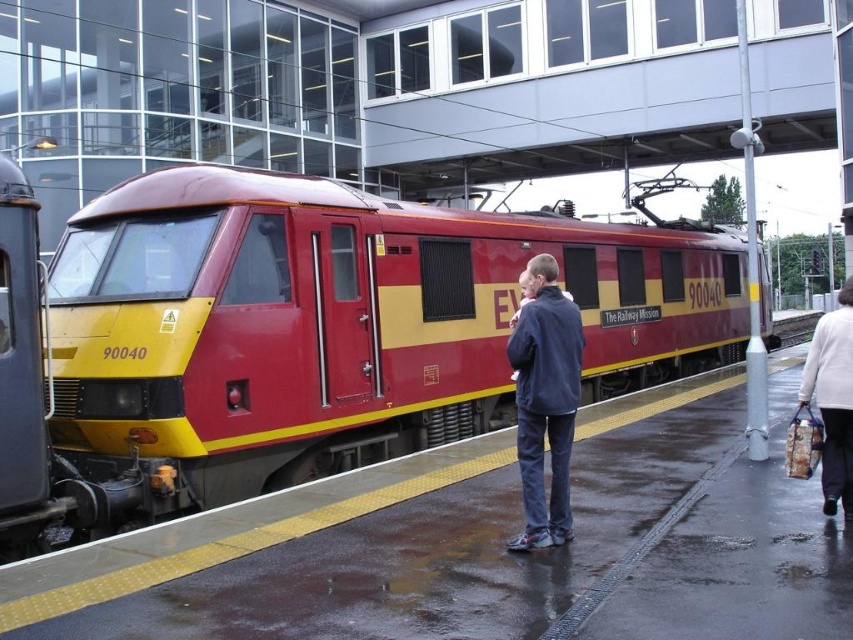
Which is more to the left, yellow rubber platform at center or white sweater at lower right?

yellow rubber platform at center is more to the left.

Is yellow rubber platform at center above white sweater at lower right?

No, yellow rubber platform at center is not above white sweater at lower right.

Which is behind, point (767, 632) or point (828, 394)?

Point (828, 394)

Where is `yellow rubber platform at center`? The image size is (853, 640). yellow rubber platform at center is located at coordinates click(485, 545).

Can you confirm if matte red/yellow train at center is shorter than yellow rubber platform at center?

No, matte red/yellow train at center is not shorter than yellow rubber platform at center.

Can you confirm if matte red/yellow train at center is thinner than yellow rubber platform at center?

In fact, matte red/yellow train at center might be wider than yellow rubber platform at center.

Is point (398, 451) more distant than point (746, 504)?

Yes, point (398, 451) is farther from viewer.

You are a GUI agent. You are given a task and a screenshot of the screen. Output one action in this format:
    pyautogui.click(x=<x>, y=<y>)
    Task: Click on the matte red/yellow train at center
    The height and width of the screenshot is (640, 853).
    Given the screenshot: What is the action you would take?
    pyautogui.click(x=335, y=326)

Consider the image. Can you confirm if yellow rubber platform at center is positioned to the left of dark blue jacket at center?

No, yellow rubber platform at center is not to the left of dark blue jacket at center.

What do you see at coordinates (485, 545) in the screenshot? This screenshot has height=640, width=853. I see `yellow rubber platform at center` at bounding box center [485, 545].

Locate an element on the screen. This screenshot has width=853, height=640. yellow rubber platform at center is located at coordinates (485, 545).